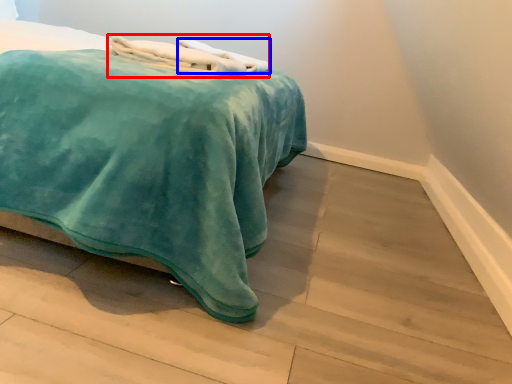
Question: Among these objects, which one is nearest to the camera, bath towel (highlighted by a red box) or bath towel (highlighted by a blue box)?

Choices:
 (A) bath towel
 (B) bath towel

Answer: (A)